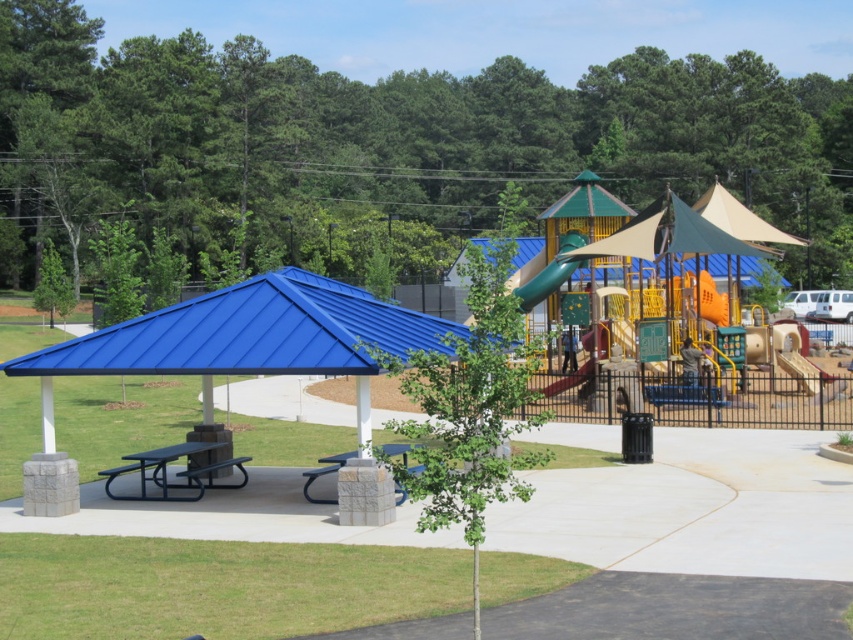
You are planning to set up a small tent for a birthday party in the playground area. The tent requires a space that is larger than the blue metal canopy at left and the stone textured picnic table at center. Based on the scene description, is there enough space available for the tent? Please explain your reasoning.

The blue metal canopy at left is larger than the stone textured picnic table at center. However, the tent requires a space larger than both. Since the blue metal canopy at left is the larger of the two, but there is no information provided about its specific dimensions relative to the required tent size, it cannot be determined if the available space is sufficient. The scene description only states the canopy is larger than the picnic table, but not how much larger or the total area needed for the tent.

You are standing at the entrance of the playground and want to find the stone textured picnic table at center. According to the coordinates provided, in which direction should you move relative to your current position?

The stone textured picnic table at center is located at coordinates point (325,474), which means it is positioned to the right and slightly forward from your current position at the entrance. Move towards the right and forward to reach it.

You are planning to set up a tent in the playground area. The tent requires a flat surface that is at least as tall as the smooth green slide at center. Can you use the area where the stone textured picnic table at center is located?

The stone textured picnic table at center is not as tall as the smooth green slide at center, so the area where the stone textured picnic table at center is located is not suitable for setting up the tent since it does not meet the required height.